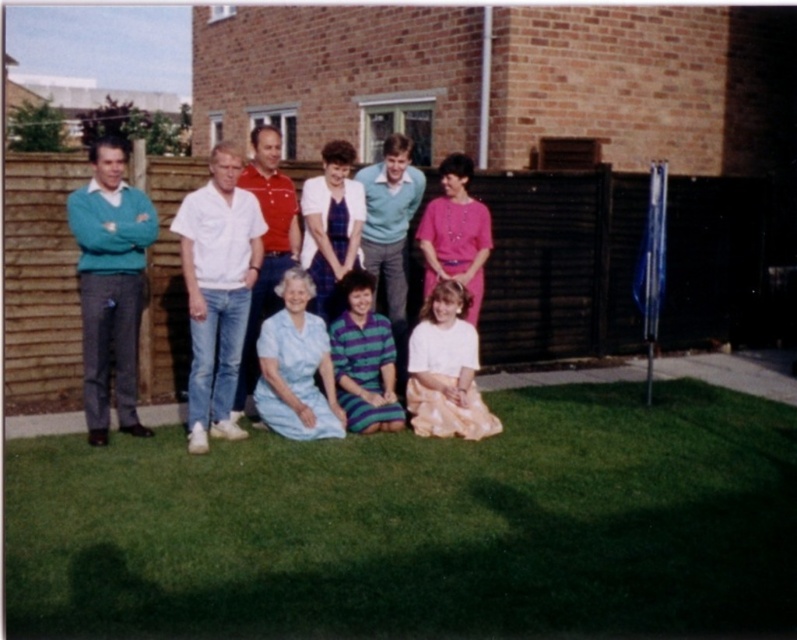
Question: Estimate the real-world distances between objects in this image. Which object is closer to the teal knit sweater at left?

Choices:
 (A) matte blue dress at center
 (B) green grass at lower center

Answer: (A)

Question: Which object is positioned closest to the teal knit sweater at left?

Choices:
 (A) matte blue dress at center
 (B) green grass at lower center

Answer: (A)

Question: Is matte blue dress at center wider than teal knit sweater at left?

Choices:
 (A) no
 (B) yes

Answer: (B)

Question: Is green grass at lower center thinner than matte blue dress at center?

Choices:
 (A) yes
 (B) no

Answer: (B)

Question: From the image, what is the correct spatial relationship of matte blue dress at center in relation to teal knit sweater at left?

Choices:
 (A) below
 (B) above

Answer: (B)

Question: Which point is farther to the camera?

Choices:
 (A) (118, 413)
 (B) (524, 426)

Answer: (B)